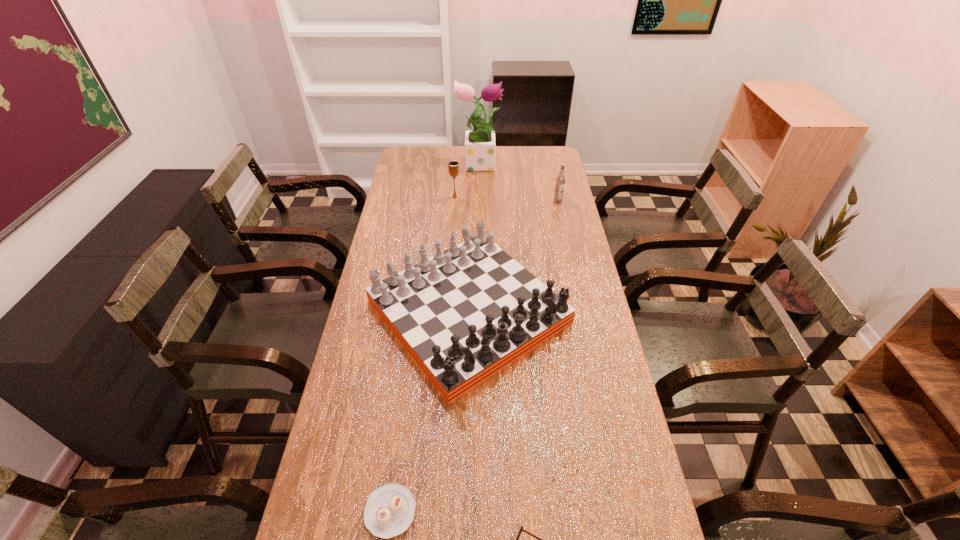
You are a GUI agent. You are given a task and a screenshot of the screen. Output one action in this format:
    pyautogui.click(x=<x>, y=<y>)
    Task: Click on the free space between the chalice and the rightmost object
    The width and height of the screenshot is (960, 540).
    Given the screenshot: What is the action you would take?
    pyautogui.click(x=506, y=199)

Identify the location of object that is the fifth closest to the farthest object. (521, 529).

Point out which object is positioned as the fifth nearest to the chalice. Please provide its 2D coordinates. Your answer should be formatted as a tuple, i.e. [(x, y)], where the tuple contains the x and y coordinates of a point satisfying the conditions above.

[(521, 529)]